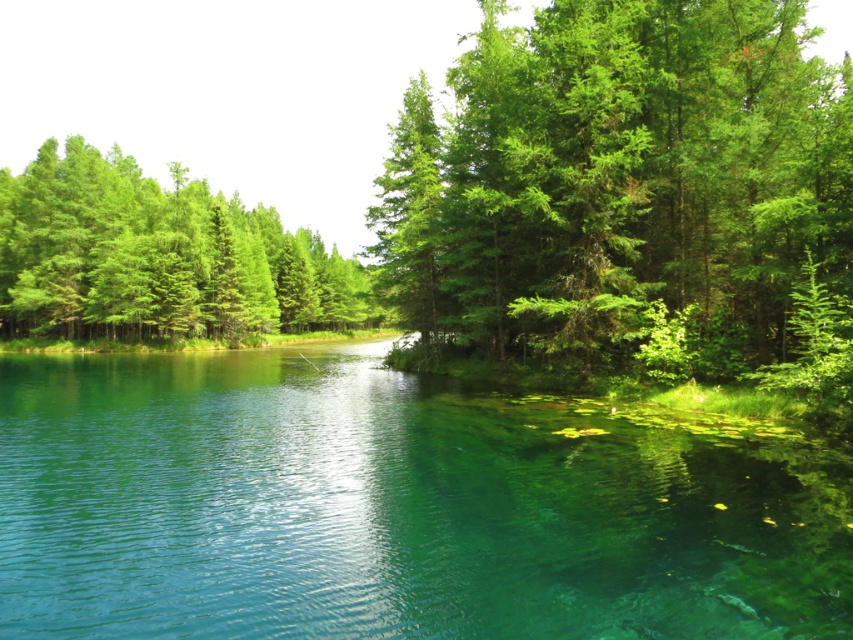
You are a hiker who wants to cross the transparent water at center to reach the green leafy tree at upper center. Is the water shallow enough for you to walk through?

The transparent water at center is positioned under the green leafy tree at upper center, which suggests it might be shallow enough for walking, but the depth isn

You are standing at the point labeled as point (x=619, y=186) in the image. Looking around, you see a green leafy tree at upper center. Which direction should you face to look towards the green leafy tree at upper center?

You are already facing the green leafy tree at upper center because the point (x=619, y=186) is the location of the green leafy tree at upper center.